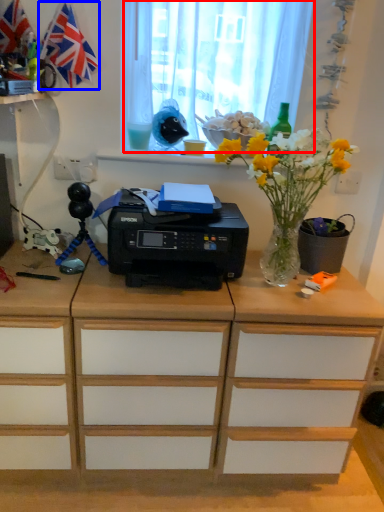
Question: Which object appears farthest to the camera in this image, curtain (highlighted by a red box) or flag (highlighted by a blue box)?

Choices:
 (A) curtain
 (B) flag

Answer: (A)